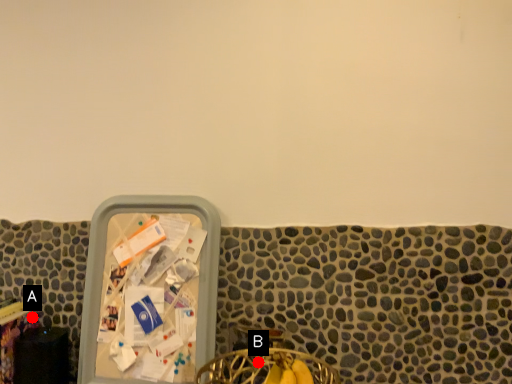
Question: Two points are circled on the image, labeled by A and B beside each circle. Which point is farther from the camera taking this photo?

Choices:
 (A) A is further
 (B) B is further

Answer: (A)